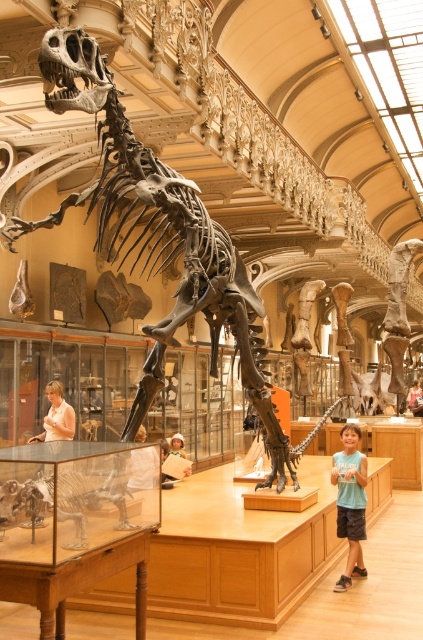
You are a visitor in the museum and see the point marked at coordinate [69,506]. Which object in the scene does this point belong to?

The point at coordinate [69,506] is on the shiny metallic dinosaur at center.